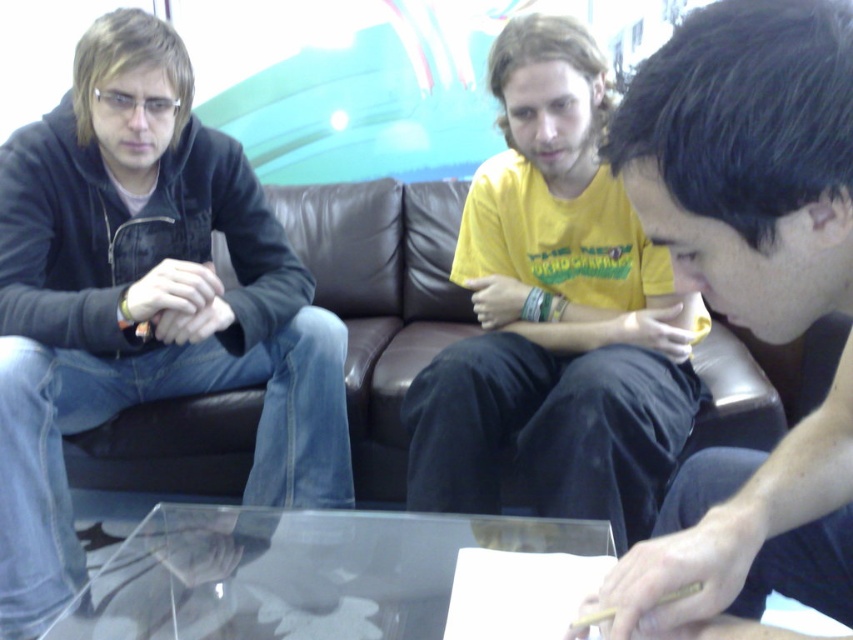
Question: Which of these objects is positioned farthest from the yellow cotton shirt at center?

Choices:
 (A) transparent glass table at center
 (B) black matte shirt at center

Answer: (B)

Question: Is matte black hoodie at left bigger than yellow cotton shirt at center?

Choices:
 (A) no
 (B) yes

Answer: (B)

Question: Which object is the farthest from the black matte shirt at center?

Choices:
 (A) transparent glass table at center
 (B) yellow cotton shirt at center

Answer: (B)

Question: Is the position of black matte shirt at center less distant than that of yellow cotton shirt at center?

Choices:
 (A) yes
 (B) no

Answer: (A)

Question: Considering the real-world distances, which object is closest to the yellow cotton shirt at center?

Choices:
 (A) brown leather couch at center
 (B) black matte shirt at center
 (C) transparent glass table at center
 (D) matte black hoodie at left

Answer: (C)

Question: Does black matte shirt at center appear over yellow cotton shirt at center?

Choices:
 (A) yes
 (B) no

Answer: (B)